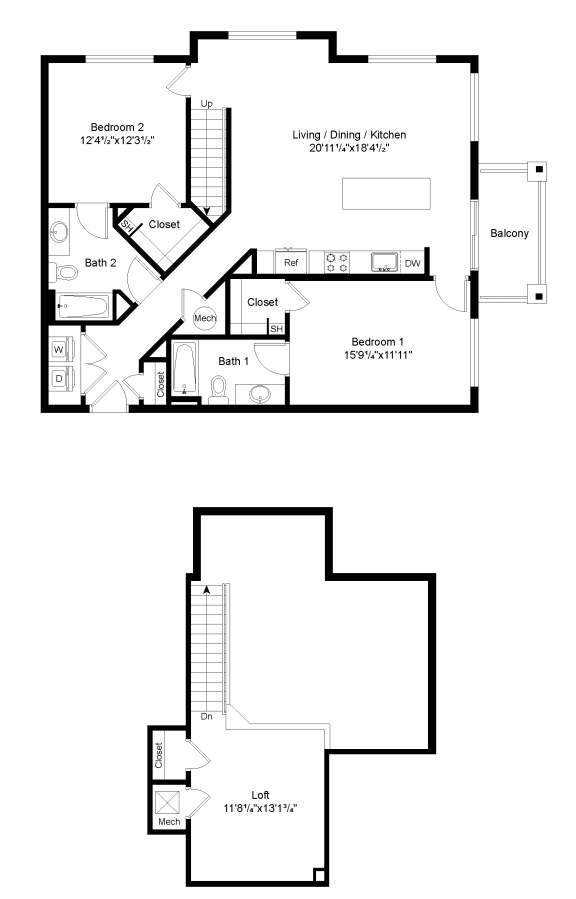
Image resolution: width=576 pixels, height=899 pixels. What are the coordinates of `bathrooms` in the screenshot? It's located at 229,350, 90,250.